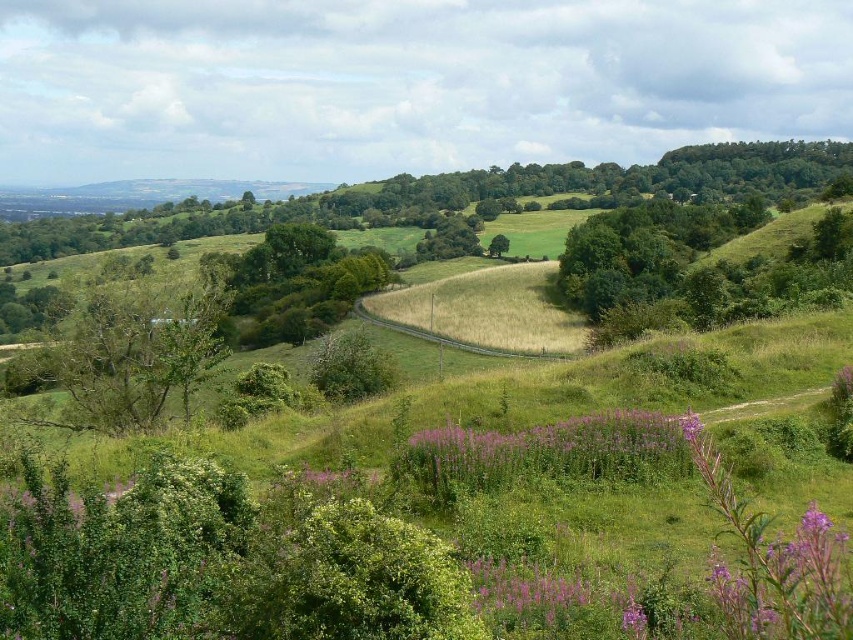
You are standing at the center of the winding dirt path in the rural landscape. You want to walk towards the green leafy tree at left. Which direction should you head?

The green leafy tree at left is located at point 0.555 on the x axis and 0.165 on the y axis. Since you are at the center of the path, you should head towards the left direction to reach the green leafy tree at left.